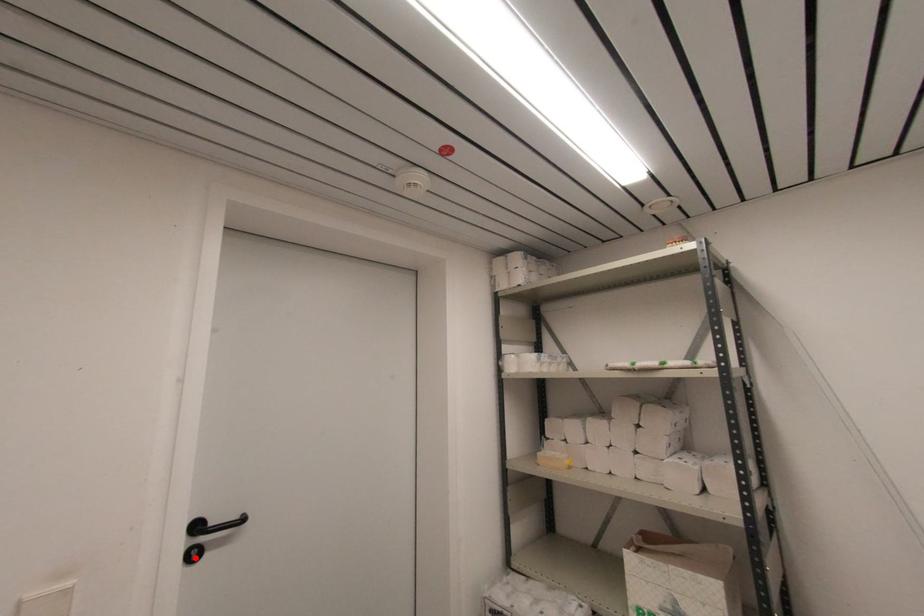
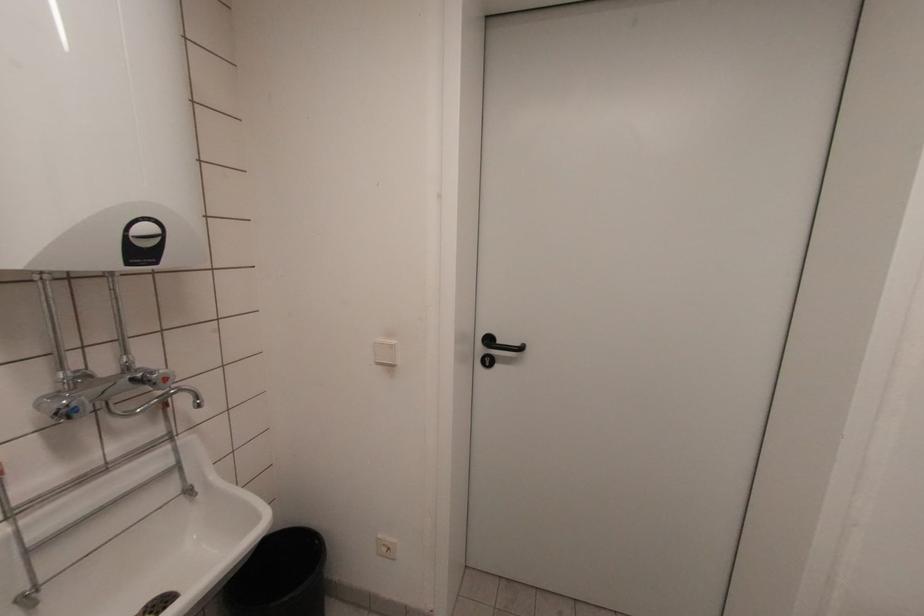
Where in the second image is the point corresponding to the highlighted location from the first image?

(488, 363)